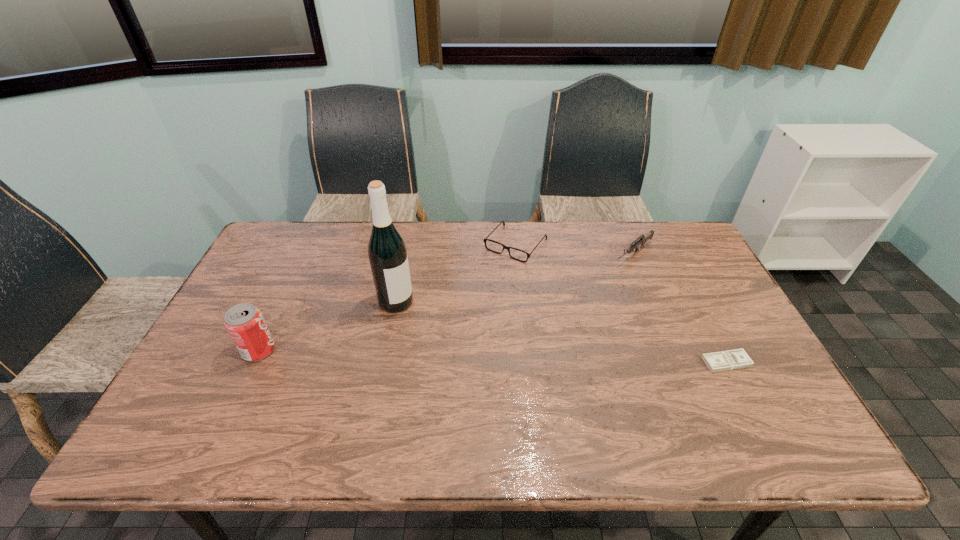
At what (x,y) coordinates should I click in order to perform the action: click on the second tallest object. Please return your answer as a coordinate pair (x, y). This screenshot has height=540, width=960. Looking at the image, I should click on (245, 324).

Where is `soda can`? The image size is (960, 540). soda can is located at coordinates (245, 324).

Where is `the shortest object`? the shortest object is located at coordinates (733, 359).

Identify the location of the fourth tallest object. (484, 240).

Image resolution: width=960 pixels, height=540 pixels. Identify the location of spectacles. tap(484, 240).

Image resolution: width=960 pixels, height=540 pixels. What are the coordinates of `the third farthest object` in the screenshot? It's located at (387, 253).

Identify the location of the fourth object from right to left. This screenshot has width=960, height=540. (387, 253).

I want to click on gun, so click(642, 239).

At what (x,y) coordinates should I click in order to perform the action: click on free space located on the back of the fourth shortest object. Please return your answer as a coordinate pair (x, y). Looking at the image, I should click on (307, 246).

At what (x,y) coordinates should I click in order to perform the action: click on free spot located on the back of the shortest object. Please return your answer as a coordinate pair (x, y). The width and height of the screenshot is (960, 540). Looking at the image, I should click on (681, 273).